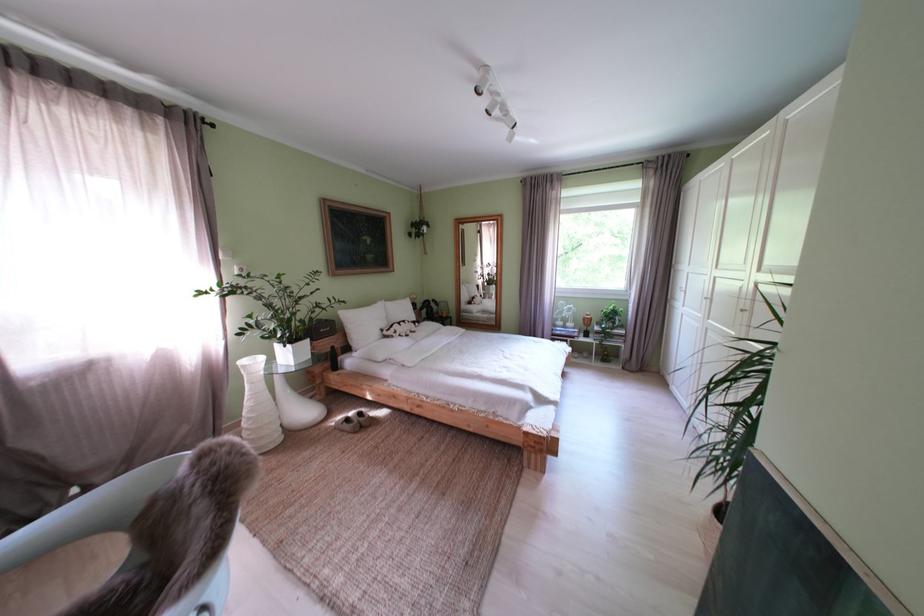
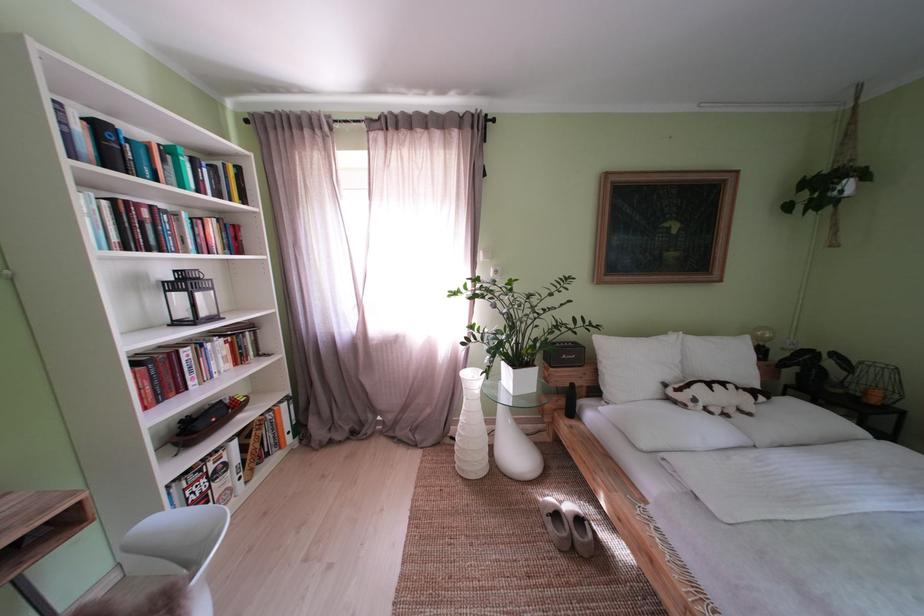
Locate, in the second image, the point that corresponds to point 259,408 in the first image.

(472, 424)